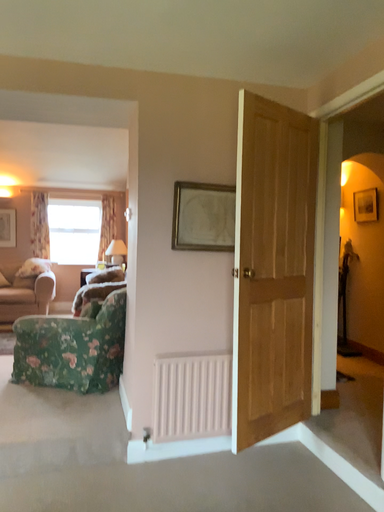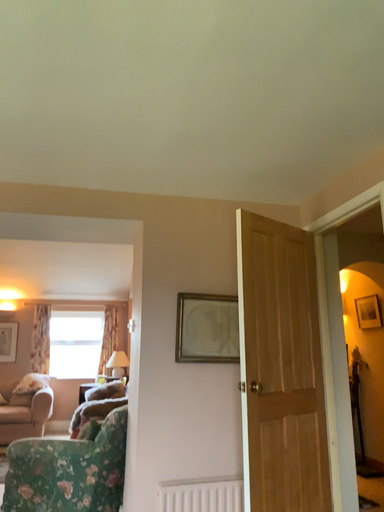
Question: How did the camera likely rotate when shooting the video?

Choices:
 (A) rotated upward
 (B) rotated downward

Answer: (A)